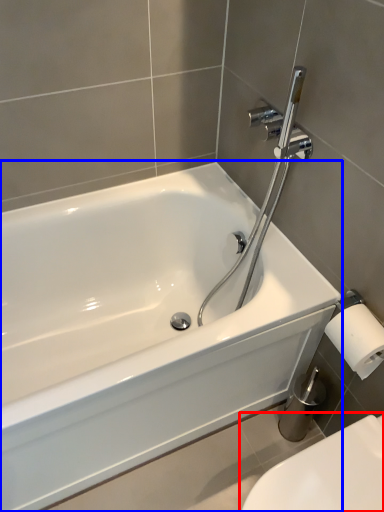
Question: Which object is further to the camera taking this photo, toilet (highlighted by a red box) or bathtub (highlighted by a blue box)?

Choices:
 (A) toilet
 (B) bathtub

Answer: (B)